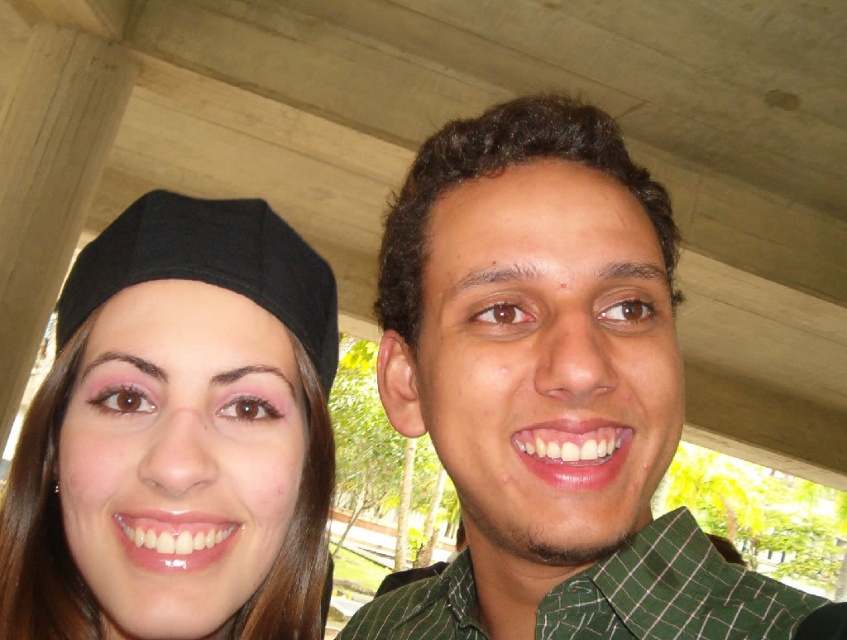
Is matte black cap at left taller than green checkered shirt at right?

Correct, matte black cap at left is much taller as green checkered shirt at right.

Between point (286, 228) and point (748, 616), which one is positioned in front?

Positioned in front is point (748, 616).

Where is `matte black cap at left`? Image resolution: width=847 pixels, height=640 pixels. matte black cap at left is located at coordinates pyautogui.click(x=178, y=435).

In the scene shown: Can you confirm if green checkered shirt at center is positioned to the right of matte black cap at left?

Indeed, green checkered shirt at center is positioned on the right side of matte black cap at left.

Who is positioned more to the right, green checkered shirt at center or matte black cap at left?

Positioned to the right is green checkered shirt at center.

Which is behind, point (421, 388) or point (296, 401)?

The point (421, 388) is behind.

I want to click on green checkered shirt at center, so click(551, 394).

Does point (562, 330) come closer to viewer compared to point (717, 596)?

Yes, it is in front of point (717, 596).

Between green checkered shirt at center and green checkered shirt at right, which one appears on the right side from the viewer's perspective?

From the viewer's perspective, green checkered shirt at center appears more on the right side.

The width and height of the screenshot is (847, 640). I want to click on green checkered shirt at center, so click(551, 394).